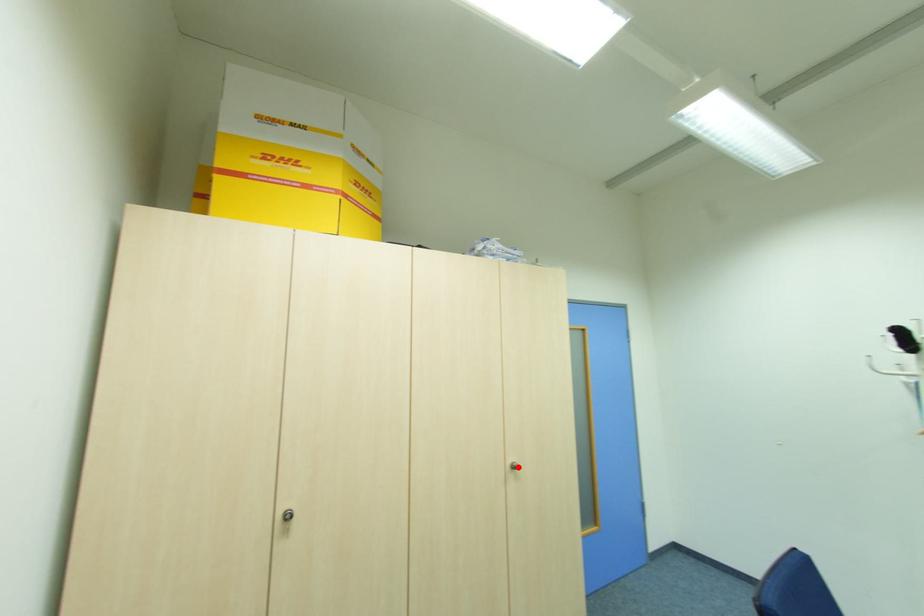
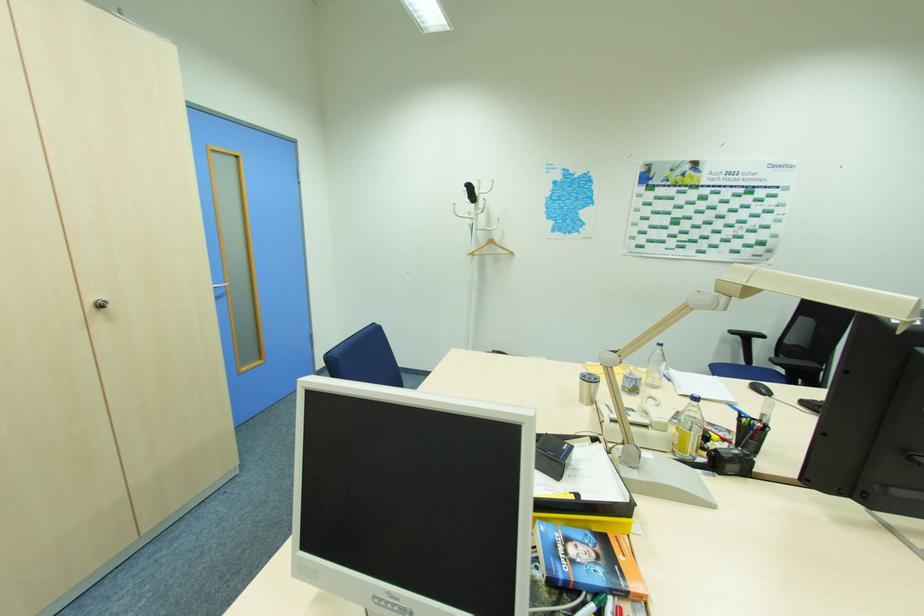
Question: I am providing you with two images of the same scene from different viewpoints. A red point is marked on the first image. Is the red point's position out of view in image 2?

Choices:
 (A) Yes
 (B) No

Answer: (B)